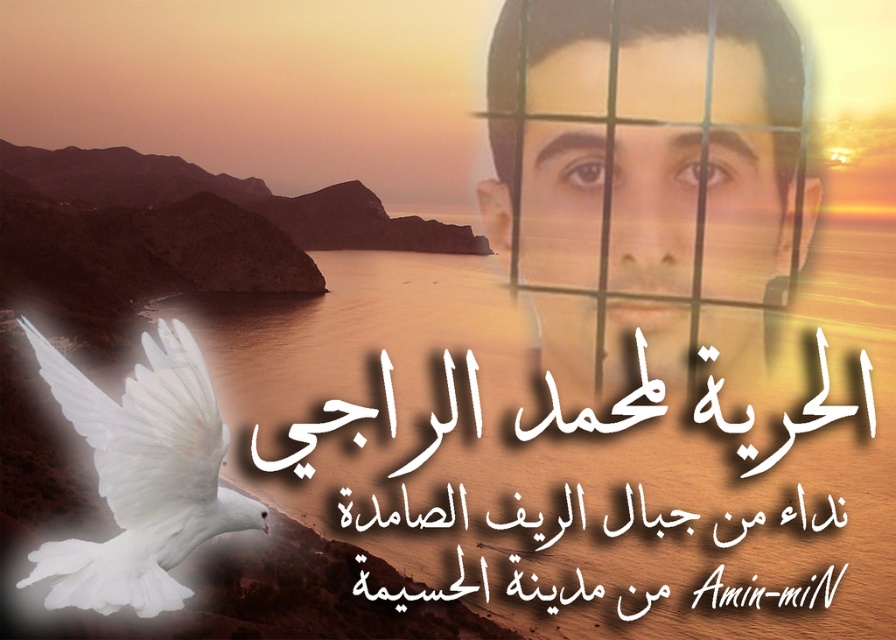
Based on the scene description, where exactly is the smooth skin face at upper right located?

The smooth skin face at upper right is located at point coordinates of (648, 145).

You are an artist who wants to paint the scene. You need to decide the size of the canvas. Given that the smooth skin face at upper right is much taller than the white feathered dove at lower left, which object should you allocate more space for in your painting?

The smooth skin face at upper right should be allocated more space in the painting since it is much taller than the white feathered dove at lower left.

Based on the scene description, can you determine the relative positions of the smooth skin face at upper right and the white feathered dove at lower left? Specifically, which object is positioned to the left?

The white feathered dove at lower left is positioned to the left of the smooth skin face at upper right.